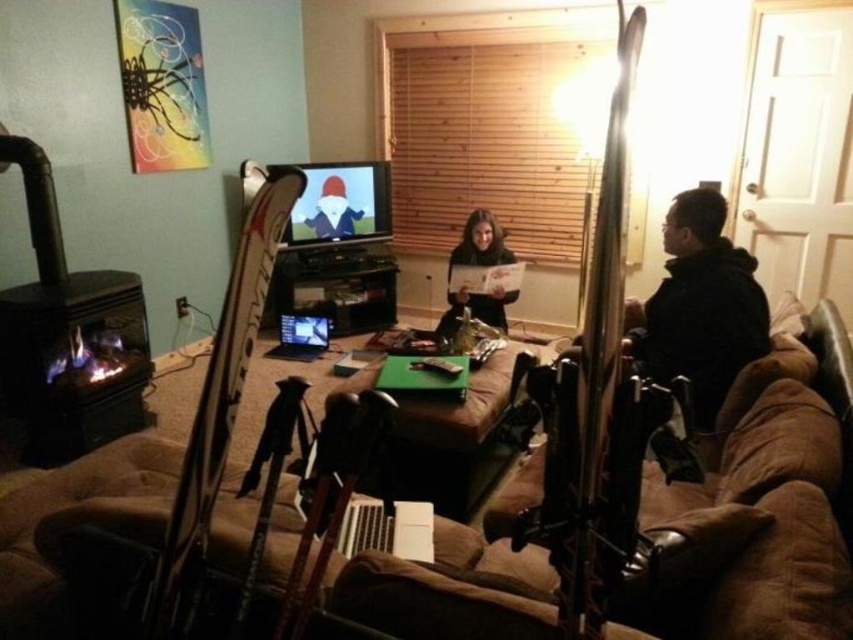
From the picture: You are standing in the living room and want to take a photo of the dark brown hair at center with a camera that has a maximum focus range of 3 meters. Can you take the photo without moving closer?

The dark brown hair at center and camera are 3.74 meters apart from each other, which exceeds the camera maximum focus range of 3 meters. You need to move closer to take the photo.

You are planning to place a new silver metallic laptop at center on the brown fabric couch at center. Will the laptop fit on the couch without hanging off the sides?

The brown fabric couch at center is wider than the silver metallic laptop at center, so the laptop will fit without hanging off the sides.

What are the coordinates of the dark brown hair at center in the image?

The coordinates of the dark brown hair at center are at point (480, 243).